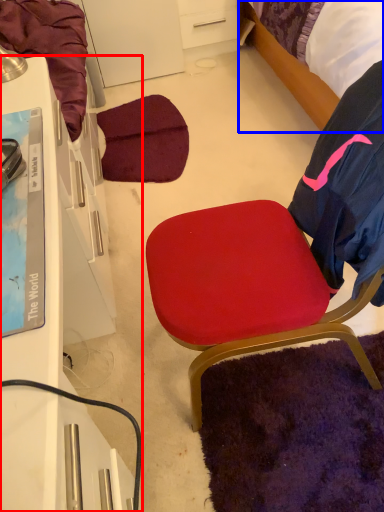
Question: Which object appears farthest to the camera in this image, desk (highlighted by a red box) or bed (highlighted by a blue box)?

Choices:
 (A) desk
 (B) bed

Answer: (B)